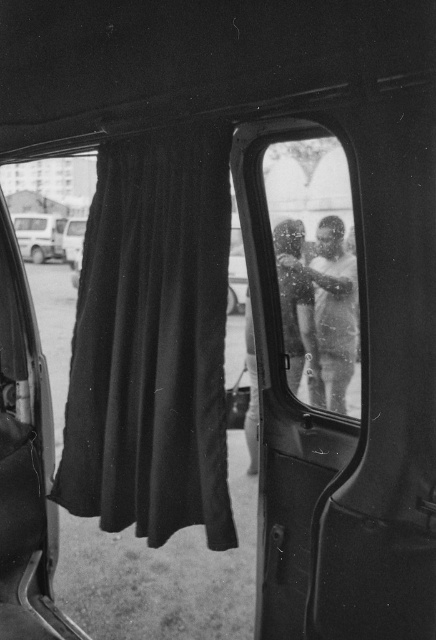
Which is in front, point (19, 225) or point (78, 236)?

Point (78, 236) is more forward.

Is metallic silver van at left to the left of metallic silver van at center from the viewer's perspective?

Correct, you'll find metallic silver van at left to the left of metallic silver van at center.

At what (x,y) coordinates should I click in order to perform the action: click on metallic silver van at left. Please return your answer as a coordinate pair (x, y). This screenshot has width=436, height=640. Looking at the image, I should click on (38, 236).

Can you confirm if black velvet curtain at left is positioned below metallic silver van at center?

Yes.

Can you confirm if black velvet curtain at left is smaller than metallic silver van at center?

No.

Is point (187, 221) behind point (68, 262)?

No, it is not.

Where is `black velvet curtain at left`? The height and width of the screenshot is (640, 436). black velvet curtain at left is located at coordinates (152, 340).

Where is `black velvet curtain at left`? black velvet curtain at left is located at coordinates (152, 340).

Consider the image. Who is positioned more to the right, black velvet curtain at left or metallic silver van at left?

From the viewer's perspective, black velvet curtain at left appears more on the right side.

Between point (143, 401) and point (44, 227), which one is positioned in front?

Positioned in front is point (143, 401).

Where is `black velvet curtain at left`? black velvet curtain at left is located at coordinates (152, 340).